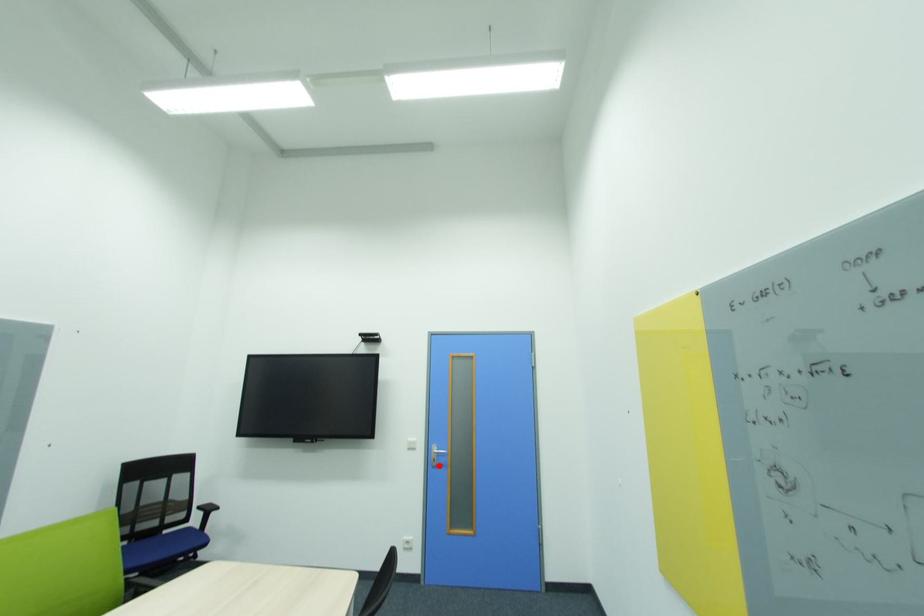
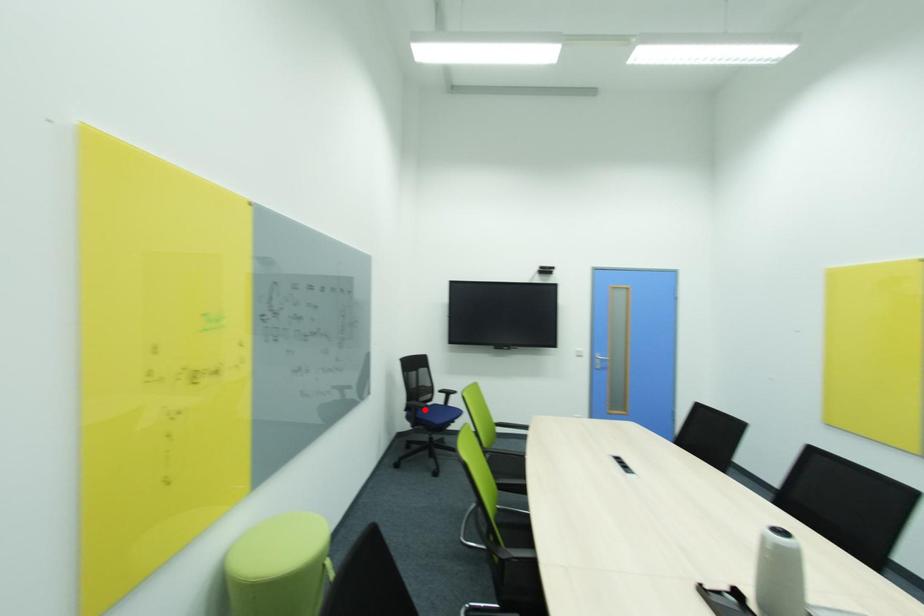
I am providing you with two images of the same scene from different viewpoints. A red point is marked on the first image and another point is marked on the second image. Do the highlighted points in image1 and image2 indicate the same real-world spot?

No